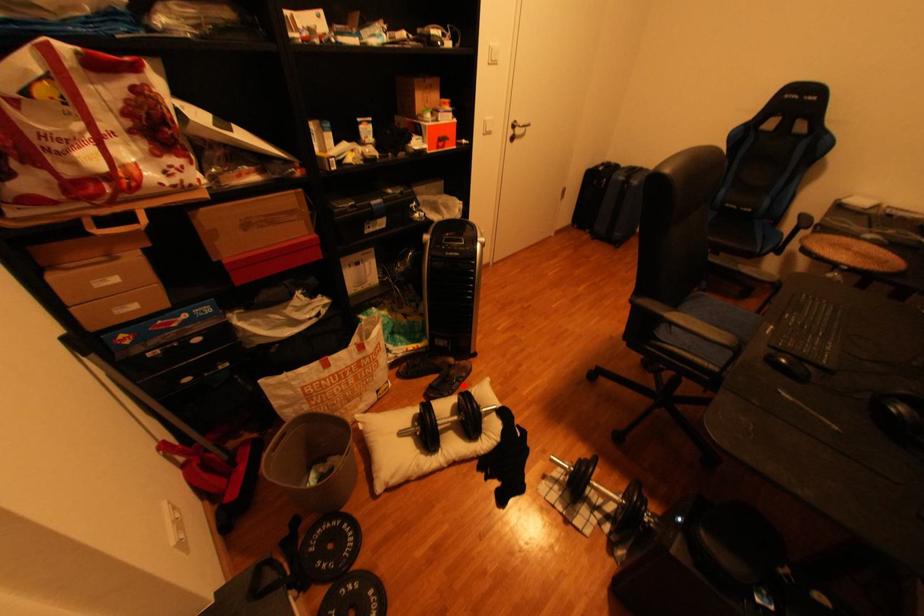
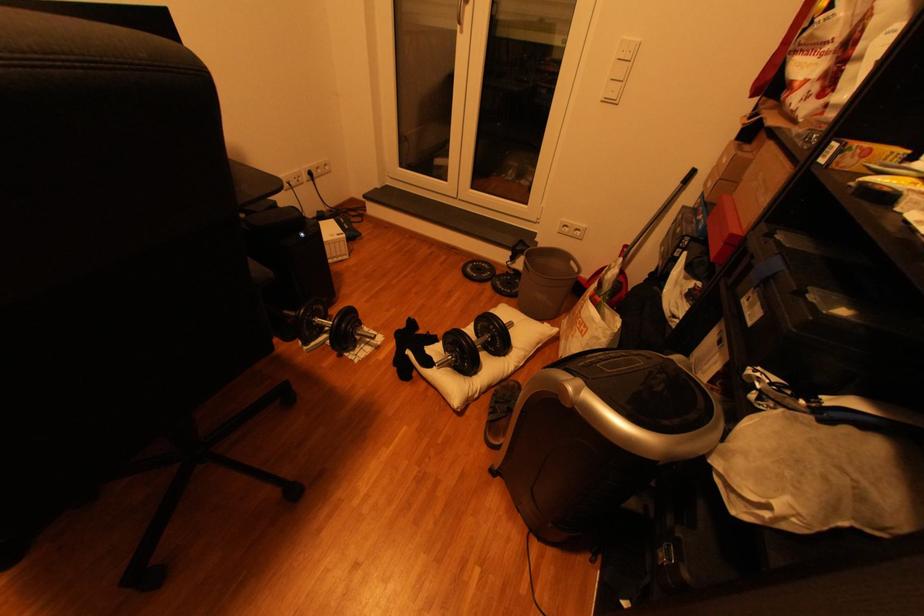
Locate, in the second image, the point that corresponds to the highlighted location in the first image.

(505, 402)